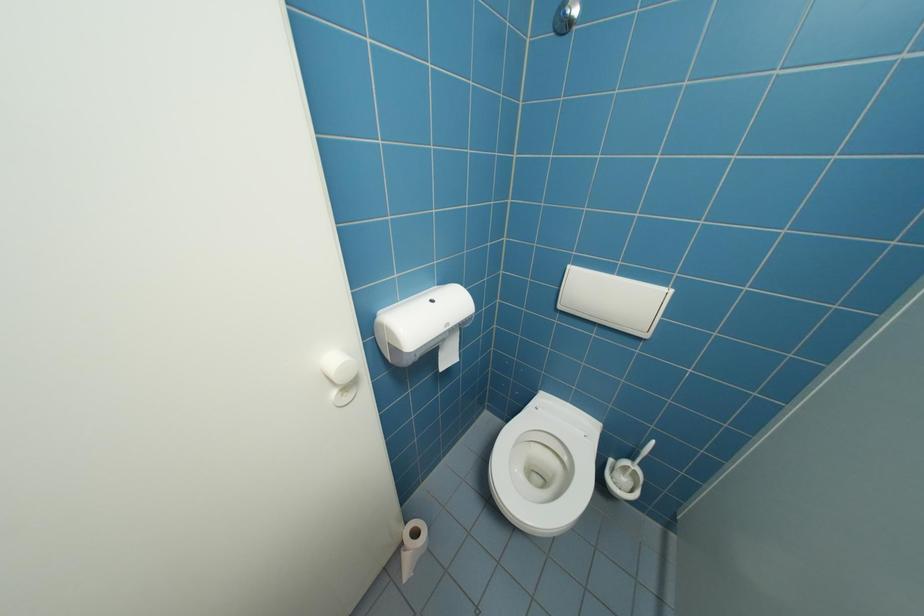
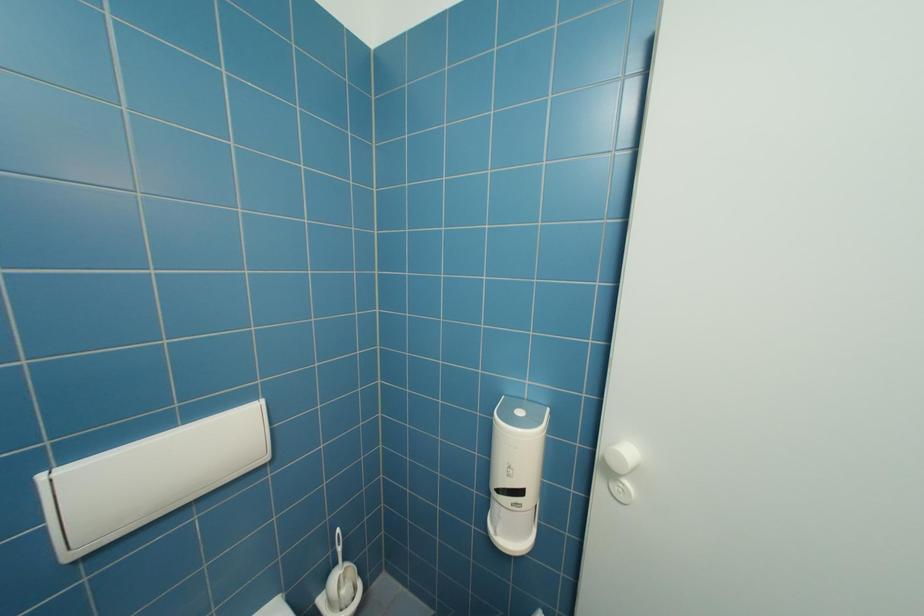
Question: How did the camera likely rotate?

Choices:
 (A) Left
 (B) Right
 (C) Up
 (D) Down

Answer: (B)